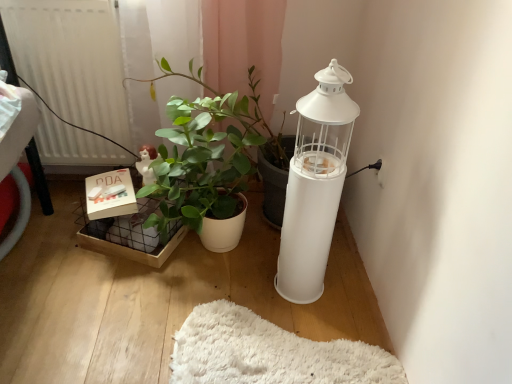
Question: From a real-world perspective, is matte white box at lower left located higher than white matte lantern at right?

Choices:
 (A) yes
 (B) no

Answer: (B)

Question: From the image's perspective, is matte white box at lower left on white matte lantern at right?

Choices:
 (A) no
 (B) yes

Answer: (B)

Question: Is matte white box at lower left turned away from white matte lantern at right?

Choices:
 (A) no
 (B) yes

Answer: (A)

Question: Is the position of matte white box at lower left more distant than that of white matte lantern at right?

Choices:
 (A) no
 (B) yes

Answer: (B)

Question: Is matte white box at lower left at the right side of white matte lantern at right?

Choices:
 (A) no
 (B) yes

Answer: (A)

Question: Is matte white box at lower left bigger than white matte lantern at right?

Choices:
 (A) no
 (B) yes

Answer: (A)

Question: Can you confirm if matte white box at lower left is bigger than white matte radiator at left?

Choices:
 (A) yes
 (B) no

Answer: (B)

Question: Is matte white box at lower left positioned in front of white matte radiator at left?

Choices:
 (A) no
 (B) yes

Answer: (A)

Question: Would you say matte white box at lower left is a long distance from white matte radiator at left?

Choices:
 (A) yes
 (B) no

Answer: (B)

Question: From the image's perspective, is matte white box at lower left on top of white matte radiator at left?

Choices:
 (A) yes
 (B) no

Answer: (B)

Question: Considering the relative sizes of matte white box at lower left and white matte radiator at left in the image provided, is matte white box at lower left wider than white matte radiator at left?

Choices:
 (A) yes
 (B) no

Answer: (A)

Question: Is matte white box at lower left surrounding white matte radiator at left?

Choices:
 (A) yes
 (B) no

Answer: (B)

Question: Can you confirm if matte white figurine at center-left is thinner than white matte radiator at left?

Choices:
 (A) yes
 (B) no

Answer: (A)